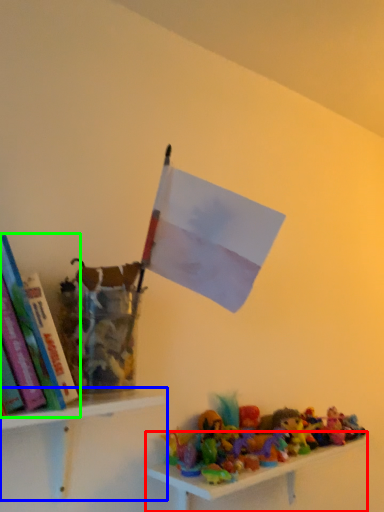
Question: Considering the real-world distances, which object is farthest from shelf (highlighted by a red box)? shelf (highlighted by a blue box) or book (highlighted by a green box)?

Choices:
 (A) shelf
 (B) book

Answer: (B)